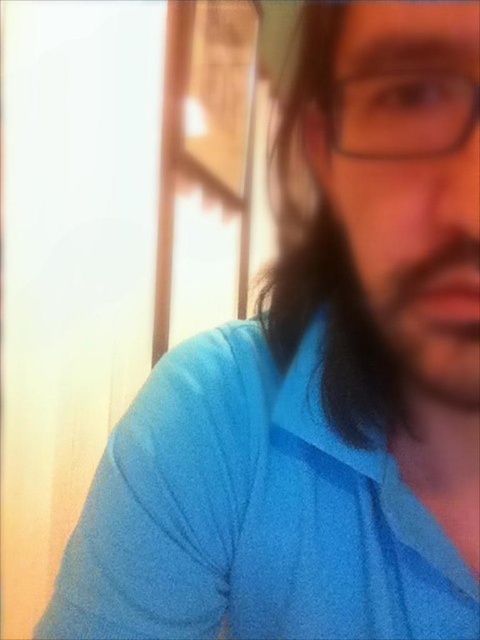
You are using a photo editing software and want to add a decorative frame around the dark brown silky hair at center. The software requires you to input the exact coordinates to place the frame. What are the coordinates you should use?

The coordinates for the dark brown silky hair at center are at point (325, 269).

Based on the photo, you are taking a selfie with a camera that has a minimum focus distance of 15 inches. Based on the image, can the camera focus on the point at coordinates point (380, 365)?

The point (380, 365) is 14.87 inches away from the camera, which is less than the minimum focus distance of 15 inches. Therefore, the camera cannot focus on the point (380, 365).

You are a photographer trying to adjust the focus of your camera. You have two options to focus on either the dark brown silky hair at center or the transparent plastic glasses at center. Given that the distance between them is 4.18 inches, which object should you focus on if you want both to be in focus simultaneously?

To have both the dark brown silky hair at center and the transparent plastic glasses at center in focus simultaneously, you should focus on the dark brown silky hair at center since it is closer to the camera. However, given the small distance of 4.18 inches between them, adjusting the focus to a midpoint might achieve acceptable sharpness for both.